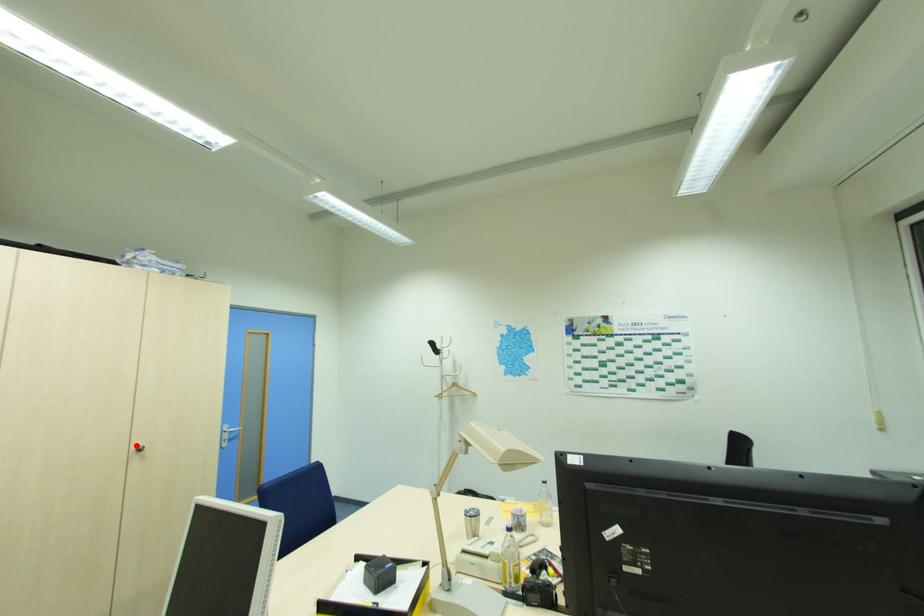
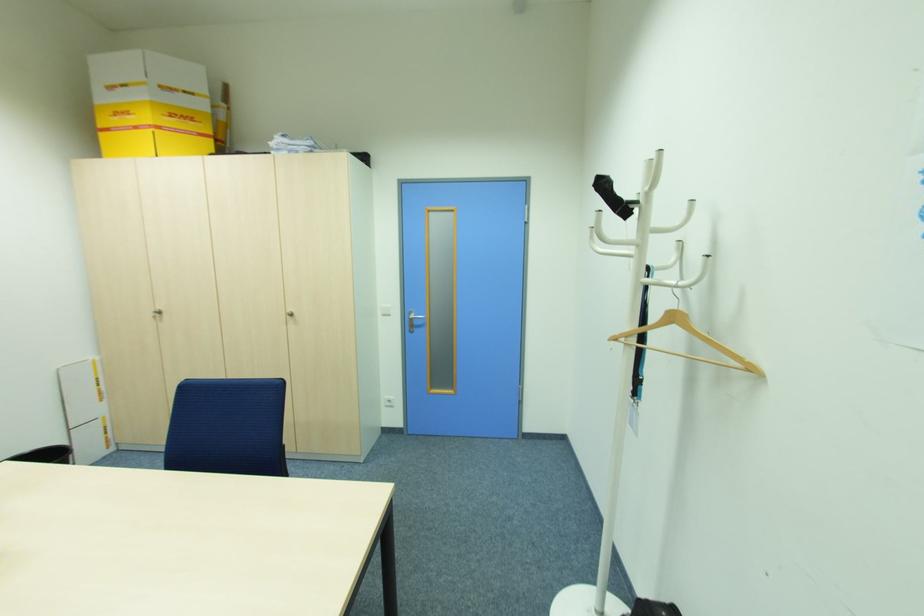
The point at the highlighted location is marked in the first image. Where is the corresponding point in the second image?

(292, 310)